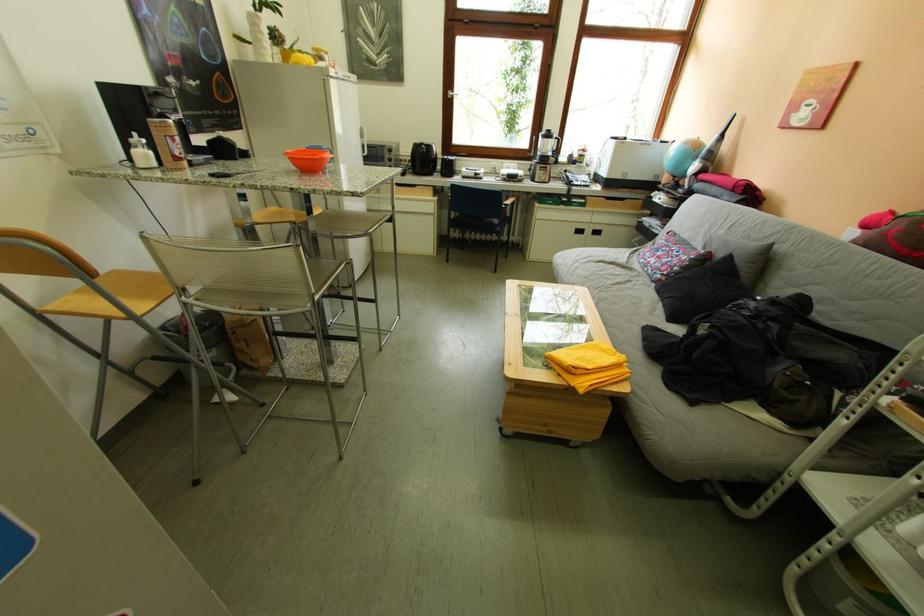
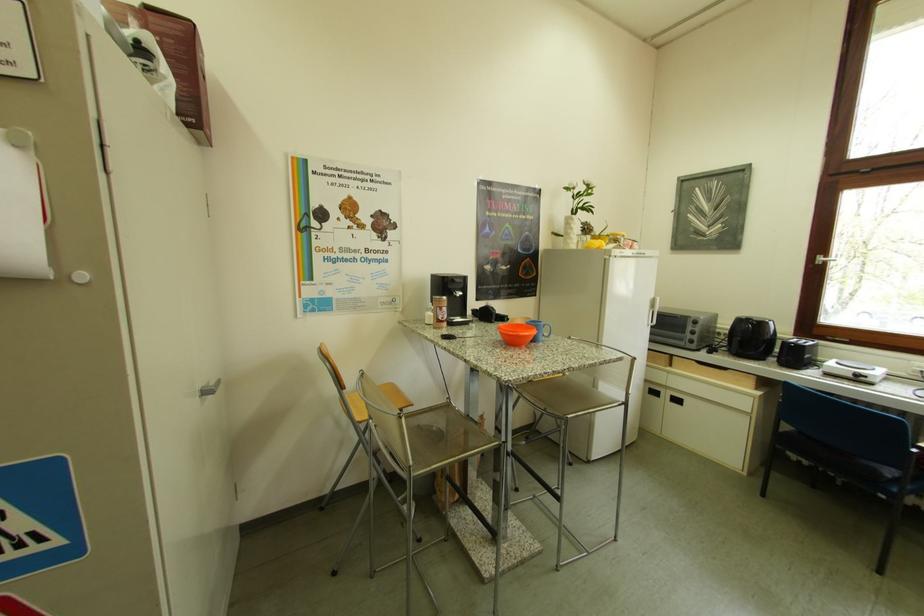
Question: The images are taken continuously from a first-person perspective. In which direction is your viewpoint rotating?

Choices:
 (A) Left
 (B) Right
 (C) Up
 (D) Down

Answer: (A)